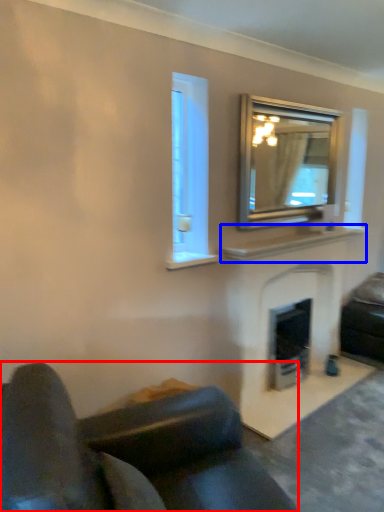
Question: Which of the following is the closest to the observer, studio couch (highlighted by a red box) or mantle (highlighted by a blue box)?

Choices:
 (A) studio couch
 (B) mantle

Answer: (A)